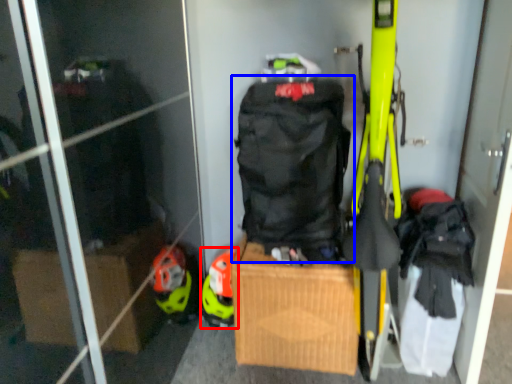
Question: Among these objects, which one is farthest to the camera, helmet (highlighted by a red box) or backpack (highlighted by a blue box)?

Choices:
 (A) helmet
 (B) backpack

Answer: (A)